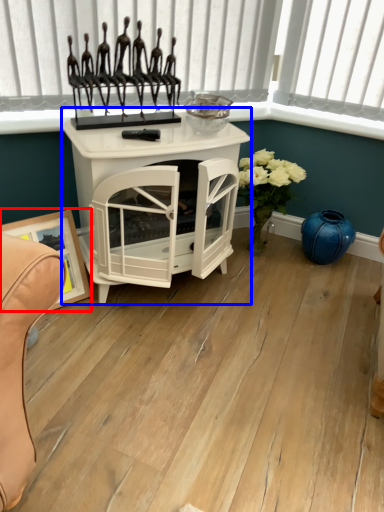
Question: Which object appears farthest to the camera in this image, picture frame (highlighted by a red box) or table (highlighted by a blue box)?

Choices:
 (A) picture frame
 (B) table

Answer: (A)